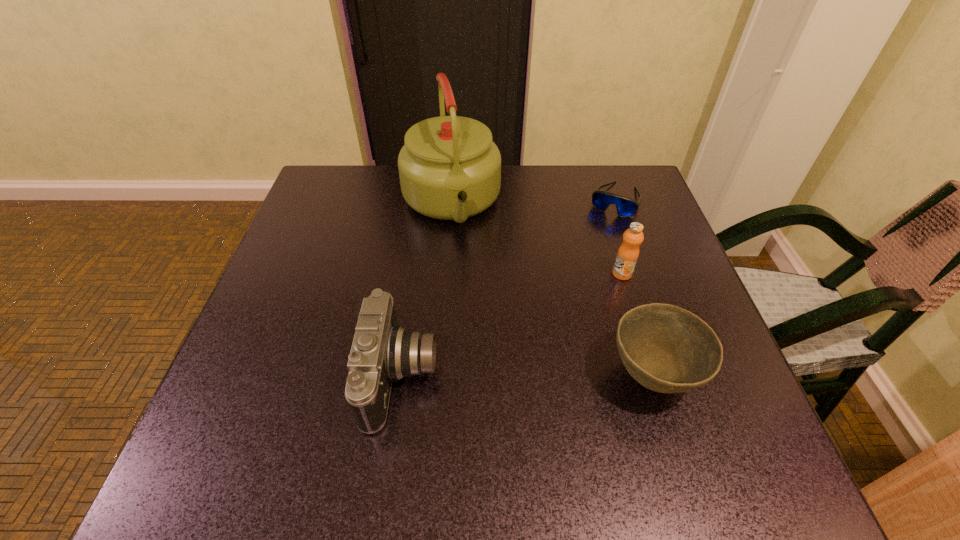
Find the location of `camera`. camera is located at coordinates 382,351.

You are a GUI agent. You are given a task and a screenshot of the screen. Output one action in this format:
    pyautogui.click(x=<x>, y=<y>)
    Task: Click on the bowl
    The image size is (960, 540).
    Given the screenshot: What is the action you would take?
    pyautogui.click(x=667, y=349)

Where is `sunglasses`? The width and height of the screenshot is (960, 540). sunglasses is located at coordinates (626, 207).

The image size is (960, 540). Identify the location of orange juice. (627, 256).

Locate an element on the screen. The width and height of the screenshot is (960, 540). kettle is located at coordinates (449, 168).

In order to click on vacant space situated 0.210m on the front-facing side of the camera in this screenshot , I will do `click(553, 376)`.

This screenshot has width=960, height=540. In order to click on free spot located 0.330m on the back of the second shortest object in this screenshot , I will do `click(606, 228)`.

You are a GUI agent. You are given a task and a screenshot of the screen. Output one action in this format:
    pyautogui.click(x=<x>, y=<y>)
    Task: Click on the free space located on the front-facing side of the sunglasses
    
    Given the screenshot: What is the action you would take?
    pyautogui.click(x=583, y=270)

Identify the location of vacant space situated on the front-facing side of the sunglasses. (583, 270).

Locate an element on the screen. The image size is (960, 540). free space located 0.380m on the front-facing side of the sunglasses is located at coordinates (557, 325).